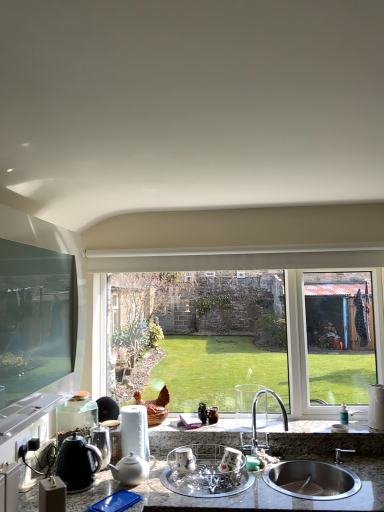
Locate an element on the screen. This screenshot has width=384, height=512. free space to the left of white ceramic vase at right, the first appliance from the right is located at coordinates (360, 425).